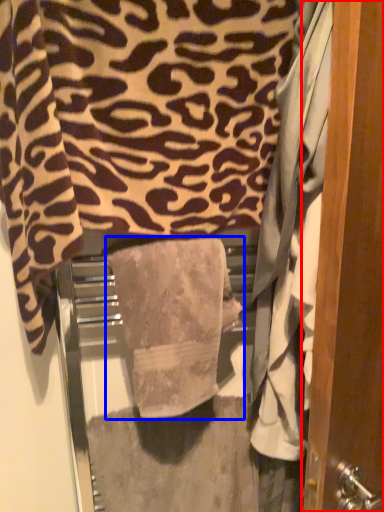
Question: Which object is further to the camera taking this photo, door (highlighted by a red box) or towel (highlighted by a blue box)?

Choices:
 (A) door
 (B) towel

Answer: (B)